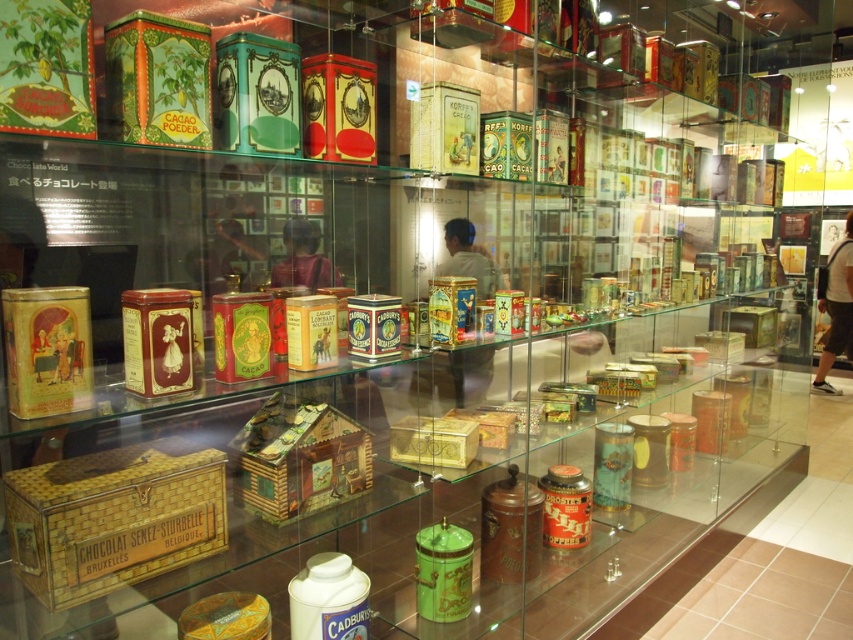
Is gold wicker box at lower left below wooden house at center?

Indeed, gold wicker box at lower left is positioned under wooden house at center.

Is gold wicker box at lower left further to camera compared to wooden house at center?

No.

What do you see at coordinates (114, 516) in the screenshot? I see `gold wicker box at lower left` at bounding box center [114, 516].

The height and width of the screenshot is (640, 853). Identify the location of gold wicker box at lower left. (114, 516).

Can you confirm if gold wicker box at lower left is positioned to the left of gold metallic box at center?

Correct, you'll find gold wicker box at lower left to the left of gold metallic box at center.

Who is more forward, (33, 561) or (473, 428)?

Point (33, 561) is in front.

Who is more distant from viewer, (61,528) or (421,458)?

The point (421,458) is more distant.

Identify the location of gold wicker box at lower left. The width and height of the screenshot is (853, 640). (114, 516).

Does wooden house at center appear on the left side of gold metallic box at center?

Correct, you'll find wooden house at center to the left of gold metallic box at center.

This screenshot has height=640, width=853. What do you see at coordinates (299, 458) in the screenshot? I see `wooden house at center` at bounding box center [299, 458].

Who is more distant from viewer, (262,492) or (416,429)?

Point (416,429)

Locate an element on the screen. This screenshot has width=853, height=640. wooden house at center is located at coordinates (299, 458).